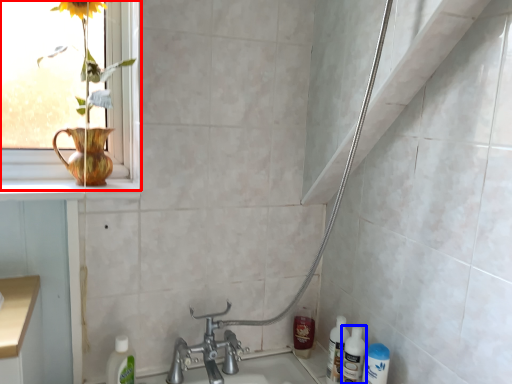
Question: Which point is closer to the camera, window (highlighted by a red box) or cleaning product (highlighted by a blue box)?

Choices:
 (A) window
 (B) cleaning product

Answer: (A)